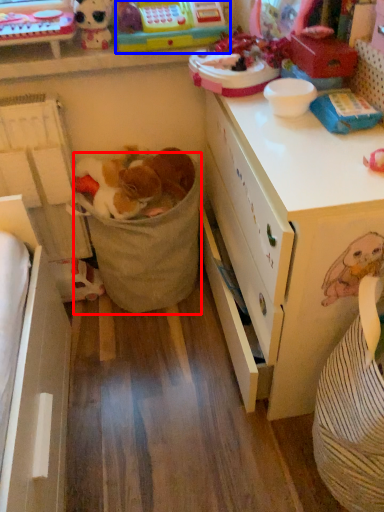
Question: Which of the following is the closest to the observer, laundry basket (highlighted by a red box) or toy (highlighted by a blue box)?

Choices:
 (A) laundry basket
 (B) toy

Answer: (B)